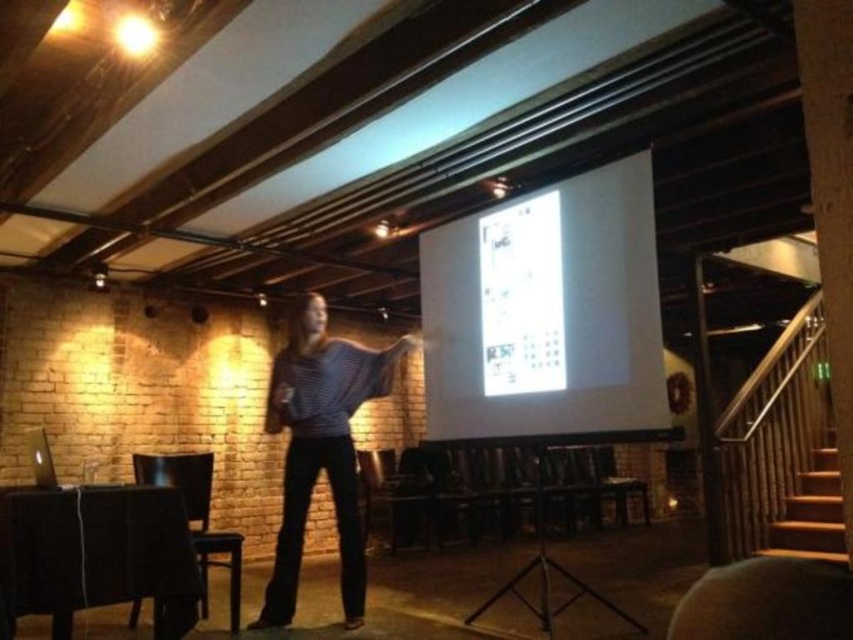
Does white glossy projection screen at upper center have a larger size compared to striped sweater at center?

Yes, white glossy projection screen at upper center is bigger than striped sweater at center.

Can you confirm if white glossy projection screen at upper center is positioned to the left of striped sweater at center?

No, white glossy projection screen at upper center is not to the left of striped sweater at center.

Who is more distant from viewer, (550, 211) or (300, 445)?

The point (300, 445) is more distant.

At what (x,y) coordinates should I click in order to perform the action: click on white glossy projection screen at upper center. Please return your answer as a coordinate pair (x, y). The width and height of the screenshot is (853, 640). Looking at the image, I should click on (547, 312).